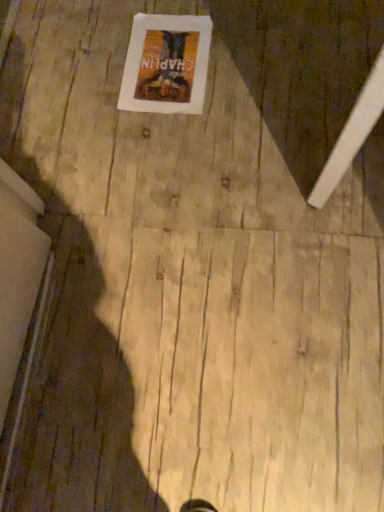
Where is `vacant region above matte paper postcard at upper center (from a real-world perspective)`? vacant region above matte paper postcard at upper center (from a real-world perspective) is located at coordinates (163, 61).